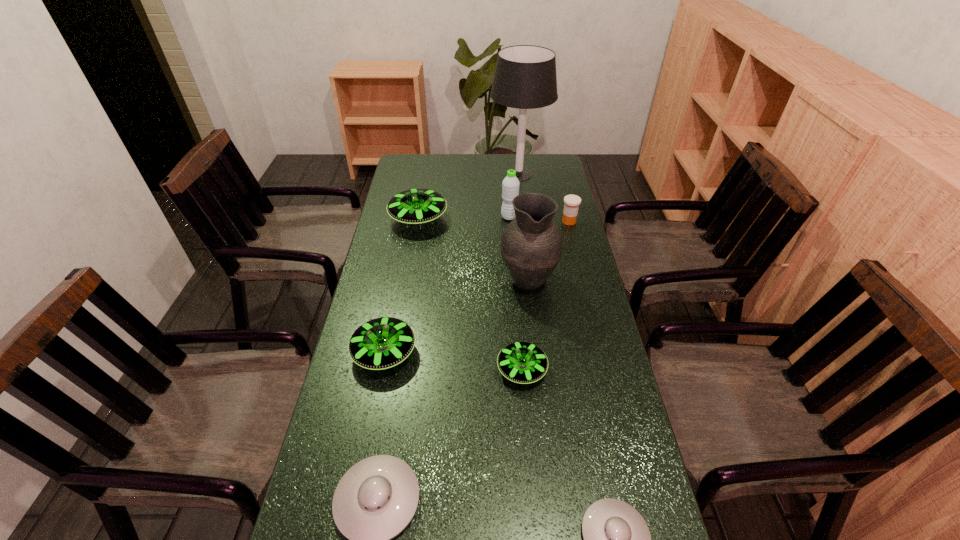
Where is `the smallest green saucer`? the smallest green saucer is located at coordinates (521, 362).

Where is `the fourth saucer from left to right`? The width and height of the screenshot is (960, 540). the fourth saucer from left to right is located at coordinates (521, 362).

Identify the location of free location located on the left of the table lamp. (414, 174).

At what (x,y) coordinates should I click in order to perform the action: click on free space located 0.210m on the side of the fifth nearest object with the handle. Please return your answer as a coordinate pair (x, y). This screenshot has width=960, height=540. Looking at the image, I should click on (521, 221).

Where is `vacant space located 0.280m on the side of the fifth nearest object with the handle`? This screenshot has height=540, width=960. vacant space located 0.280m on the side of the fifth nearest object with the handle is located at coordinates (520, 211).

Where is `vacant space located on the side of the fifth nearest object with the handle`? The image size is (960, 540). vacant space located on the side of the fifth nearest object with the handle is located at coordinates (519, 205).

I want to click on vacant space located on the front of the water bottle, so click(514, 269).

Where is `blank space located on the right of the farthest green saucer`? blank space located on the right of the farthest green saucer is located at coordinates point(520,218).

This screenshot has width=960, height=540. In order to click on blank space located 0.390m on the label of the medicine in this screenshot , I will do `click(588, 301)`.

I want to click on free space located 0.310m on the front of the second tallest saucer, so click(x=355, y=504).